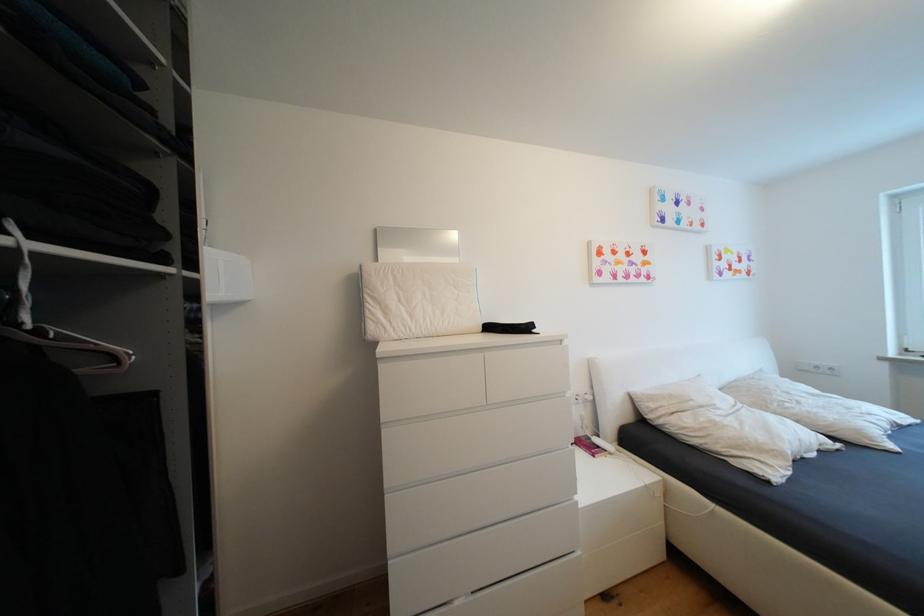
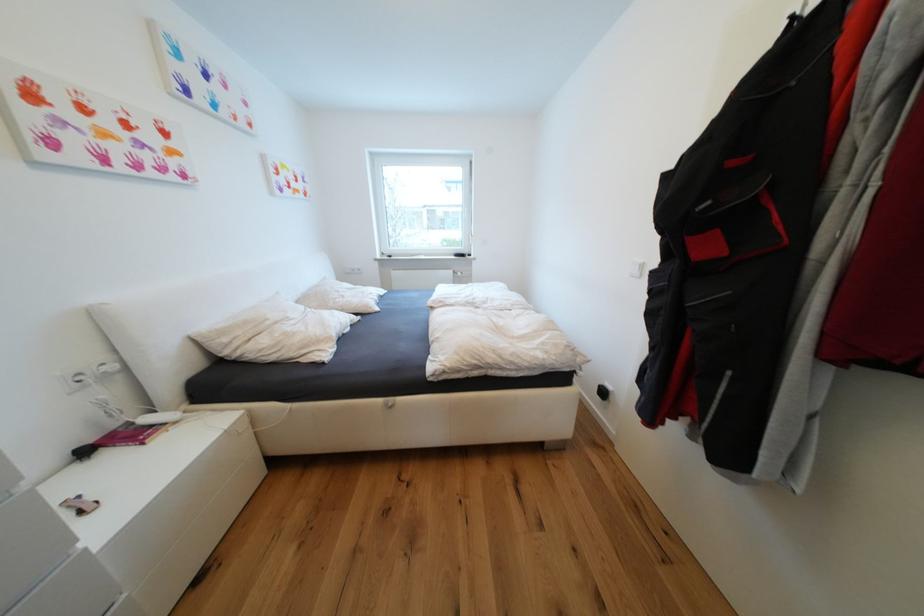
The point at (660, 407) is marked in the first image. Where is the corresponding point in the second image?

(233, 341)